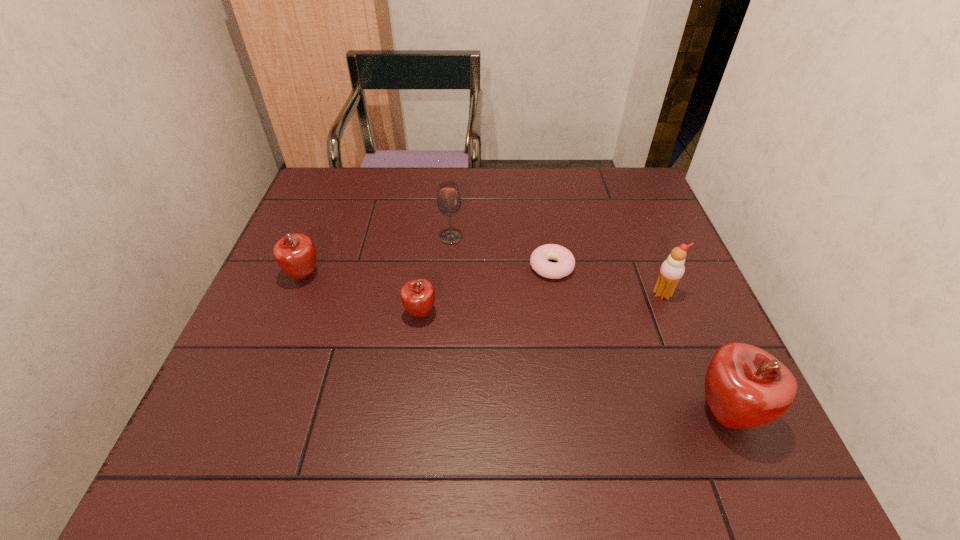
Locate an element on the screen. free space located on the back of the leftmost object is located at coordinates (323, 230).

The height and width of the screenshot is (540, 960). Find the location of `blank area located 0.070m on the back of the fifth tallest object`. blank area located 0.070m on the back of the fifth tallest object is located at coordinates (424, 280).

Identify the location of vacant region located on the left of the tallest apple. This screenshot has width=960, height=540. (532, 414).

This screenshot has height=540, width=960. I want to click on vacant space located at the front with a straw on the icecream, so click(x=711, y=417).

At what (x,y) coordinates should I click in order to perform the action: click on free space located 0.390m on the front of the glass drink container. Please return your answer as a coordinate pair (x, y). Image resolution: width=960 pixels, height=540 pixels. Looking at the image, I should click on (442, 370).

Locate an element on the screen. The image size is (960, 540). free space located on the front of the fourth object from left to right is located at coordinates (569, 374).

Locate an element on the screen. object that is at the near edge is located at coordinates (745, 386).

At what (x,y) coordinates should I click in order to perform the action: click on object positioned at the left edge. Please return your answer as a coordinate pair (x, y). The height and width of the screenshot is (540, 960). Looking at the image, I should click on (295, 253).

I want to click on apple that is at the right edge, so click(745, 386).

The width and height of the screenshot is (960, 540). Find the location of `icecream situated at the right edge`. icecream situated at the right edge is located at coordinates (672, 270).